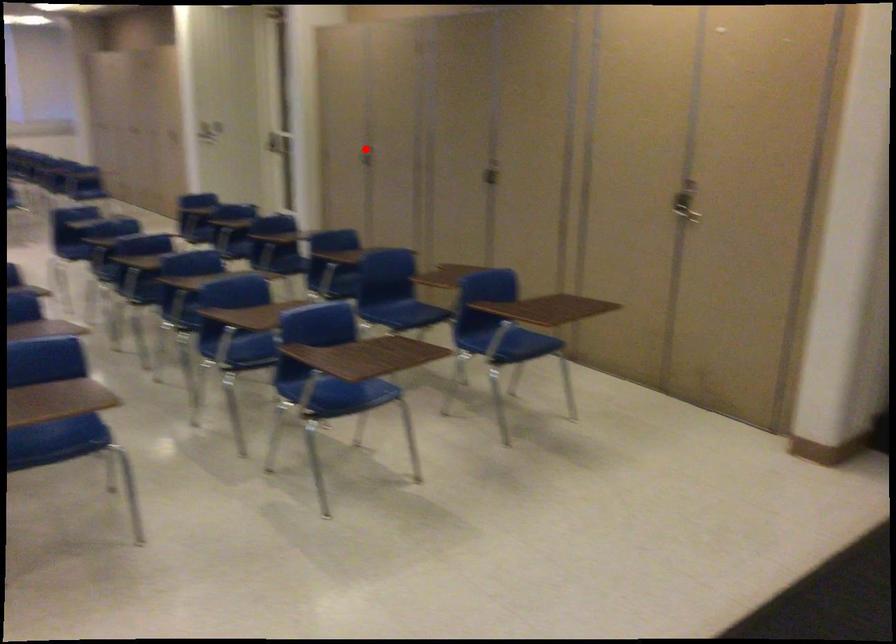
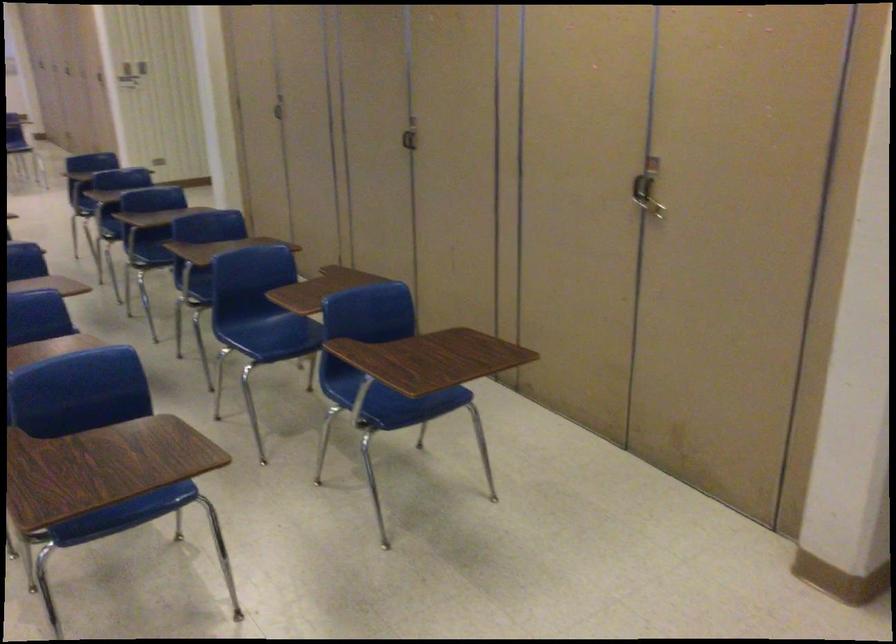
In the second image, find the point that corresponds to the highlighted location in the first image.

(279, 107)